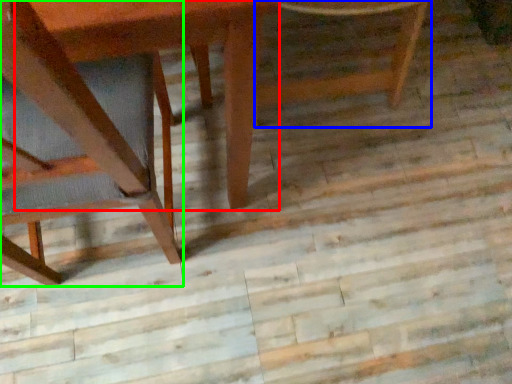
Question: Which is nearer to the round table (highlighted by a red box)? chair (highlighted by a blue box) or chair (highlighted by a green box).

Choices:
 (A) chair
 (B) chair

Answer: (B)